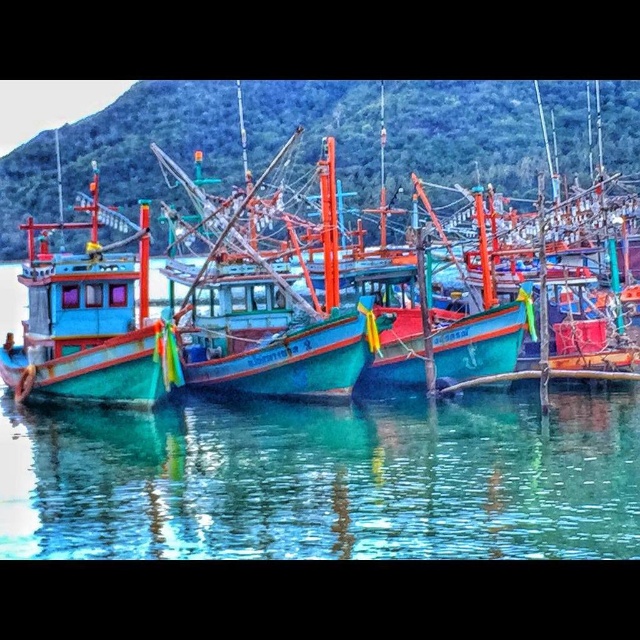
You are standing at the pier and want to take a photo of the teal wooden boat at center. If your camera can focus on objects up to 200 feet away, will you be able to capture a clear image of the boat?

The teal wooden boat at center is 218.61 feet away from the camera. Since the camera can only focus up to 200 feet, the boat is beyond the camera range. You won

You are a photographer trying to capture the reflection of the boats in the transparent water at center. Based on the coordinates provided, where exactly should you position your camera to ensure the reflection is clearly visible?

The transparent water at center is located at coordinates point (323, 481), so positioning the camera directly above or facing this point will ensure the reflection of the boats is clearly visible.

You are a sailor trying to navigate a small dinghy through the harbor. You see the transparent water at center and the teal wooden boat at center. Which one should you avoid to prevent hitting the boat?

You should avoid the teal wooden boat at center because the transparent water at center is smaller in size and less likely to obstruct your path.